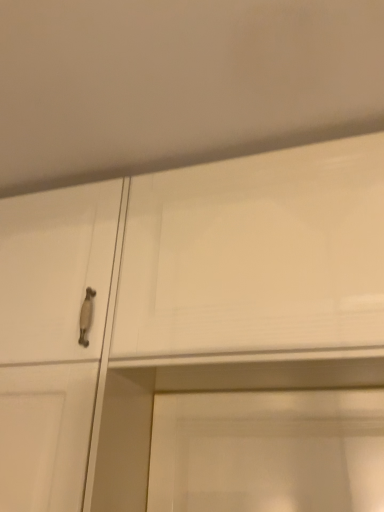
Where is `white glossy drawer at center`? white glossy drawer at center is located at coordinates (256, 254).

This screenshot has height=512, width=384. Describe the element at coordinates (256, 254) in the screenshot. I see `white glossy drawer at center` at that location.

Locate an element on the screen. Image resolution: width=384 pixels, height=512 pixels. white glossy drawer at center is located at coordinates (256, 254).